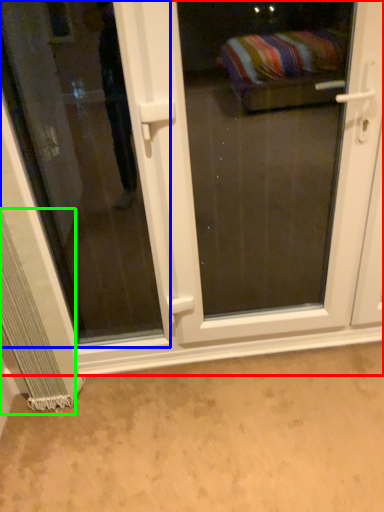
Question: Based on their relative distances, which object is nearer to door (highlighted by a red box)? Choose from window (highlighted by a blue box) and curtain (highlighted by a green box).

Choices:
 (A) window
 (B) curtain

Answer: (A)